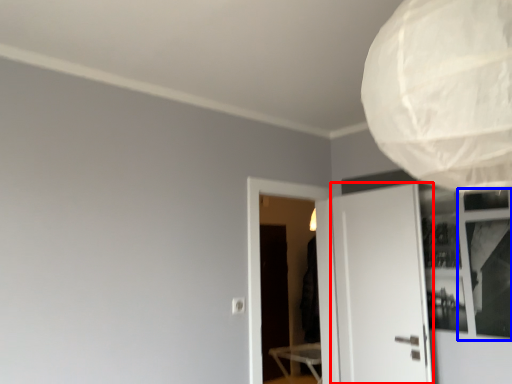
Question: Among these objects, which one is nearest to the camera, door (highlighted by a red box) or window (highlighted by a blue box)?

Choices:
 (A) door
 (B) window

Answer: (B)